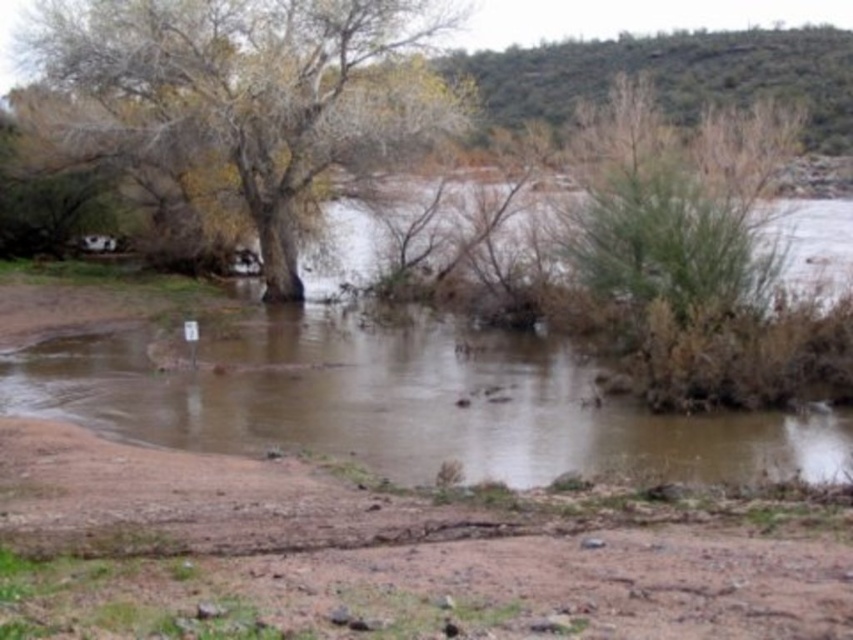
You are standing at the edge of the flooded riverbank and want to cross to the other side. There are two points marked on the image, point A at coordinates point (364, 433) and point B at coordinates point (279, 189). Which point is closer to you and safer to step on first?

Point point (364, 433) is closer to the viewer than point point (279, 189), so it is safer to step on point point (364, 433) first.

You are a hiker trying to cross the flooded area. You notice a brown rough tree at upper left and a green leafy bush at upper right in the distance. Which one has a wider base that could provide better stability for support?

The brown rough tree at upper left has a wider base than the green leafy bush at upper right, so it would provide better stability for support.

You are standing on the muddy path and want to reach the green leafy bush at upper right. Which direction should you move to avoid the brown muddy water at center?

You should move to the upper right direction to reach the green leafy bush at upper right while avoiding the brown muddy water at center, as the water is located below the bush.